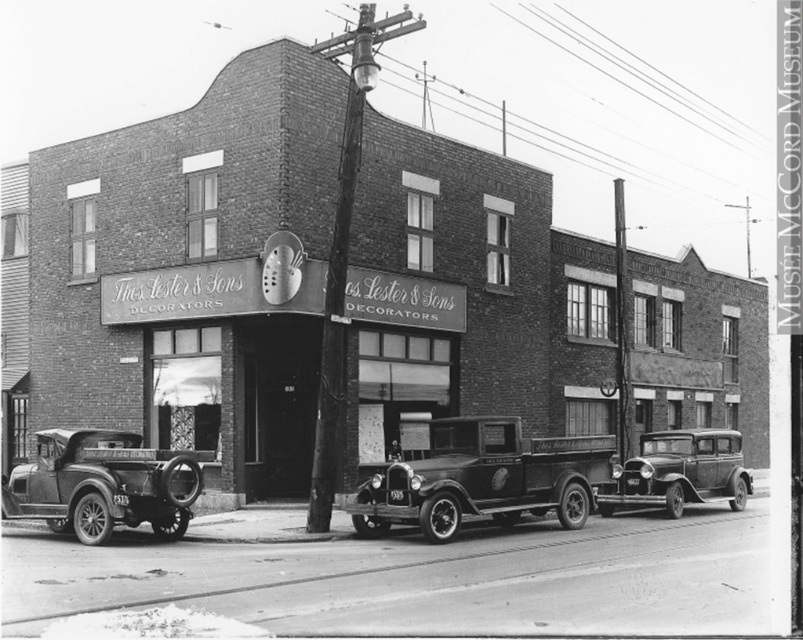
Does smooth metal sign at center have a greater width compared to shiny black sedan at center?

Correct, the width of smooth metal sign at center exceeds that of shiny black sedan at center.

Who is more forward, (153, 298) or (659, 484)?

Positioned in front is point (659, 484).

Where is `smooth metal sign at center`? smooth metal sign at center is located at coordinates (202, 292).

Is polished wood pickup truck at center closer to the viewer compared to polished chrome car at left?

No, polished wood pickup truck at center is further to the viewer.

Is polished wood pickup truck at center shorter than polished chrome car at left?

In fact, polished wood pickup truck at center may be taller than polished chrome car at left.

Image resolution: width=803 pixels, height=640 pixels. I want to click on polished wood pickup truck at center, so click(483, 477).

Who is taller, polished wood pickup truck at center or smooth metal sign at center?

polished wood pickup truck at center is taller.

What do you see at coordinates (483, 477) in the screenshot?
I see `polished wood pickup truck at center` at bounding box center [483, 477].

Which is behind, point (573, 504) or point (125, 310)?

Point (125, 310)

Find the location of a particular element. The height and width of the screenshot is (640, 803). polished wood pickup truck at center is located at coordinates (483, 477).